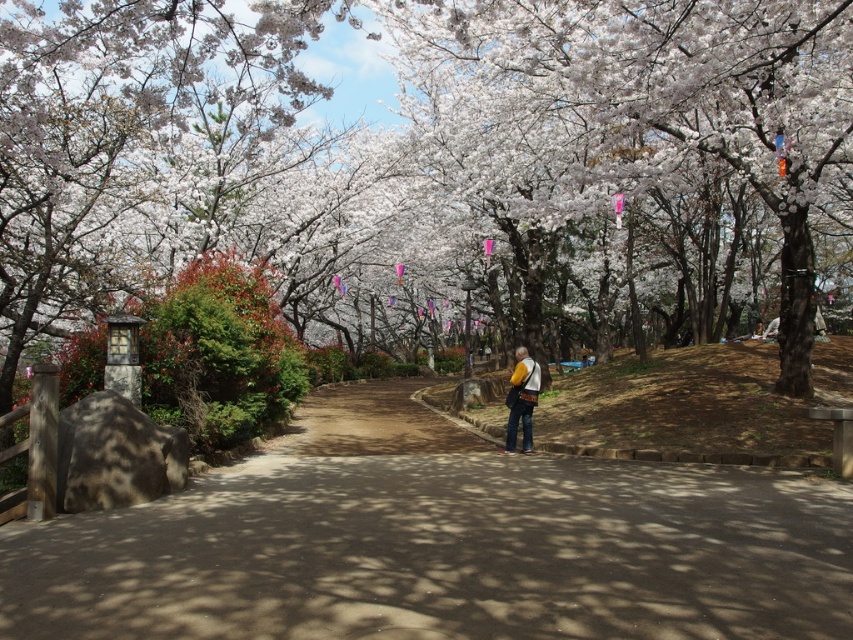
Question: Which point is farther from the camera taking this photo?

Choices:
 (A) tap(512, 433)
 (B) tap(624, 538)

Answer: (A)

Question: Is white blossoms at center above yellow fabric bag at center?

Choices:
 (A) no
 (B) yes

Answer: (B)

Question: Which of the following is the closest to the observer?

Choices:
 (A) (593, 19)
 (B) (416, 577)

Answer: (B)

Question: Is brown dirt path at center in front of yellow fabric bag at center?

Choices:
 (A) no
 (B) yes

Answer: (B)

Question: Can you confirm if brown dirt path at center is bigger than yellow fabric bag at center?

Choices:
 (A) no
 (B) yes

Answer: (B)

Question: Considering the real-world distances, which object is farthest from the brown dirt path at center?

Choices:
 (A) yellow fabric bag at center
 (B) white blossoms at center

Answer: (B)